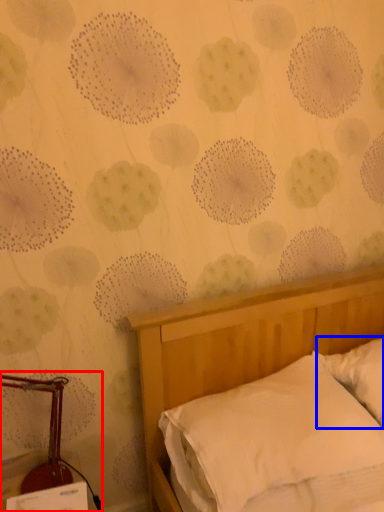
Question: Which object appears closest to the camera in this image, bedside lamp (highlighted by a red box) or pillow (highlighted by a blue box)?

Choices:
 (A) bedside lamp
 (B) pillow

Answer: (A)